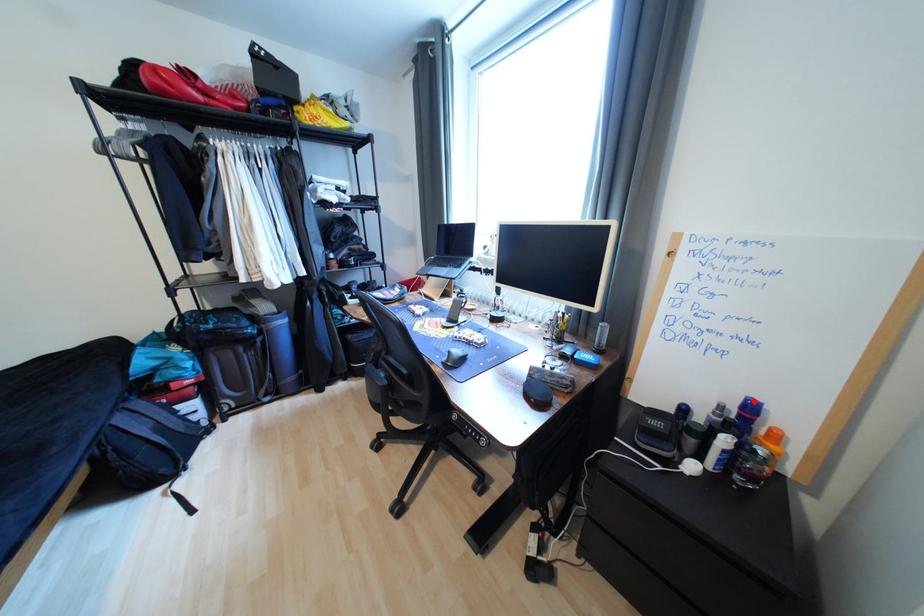
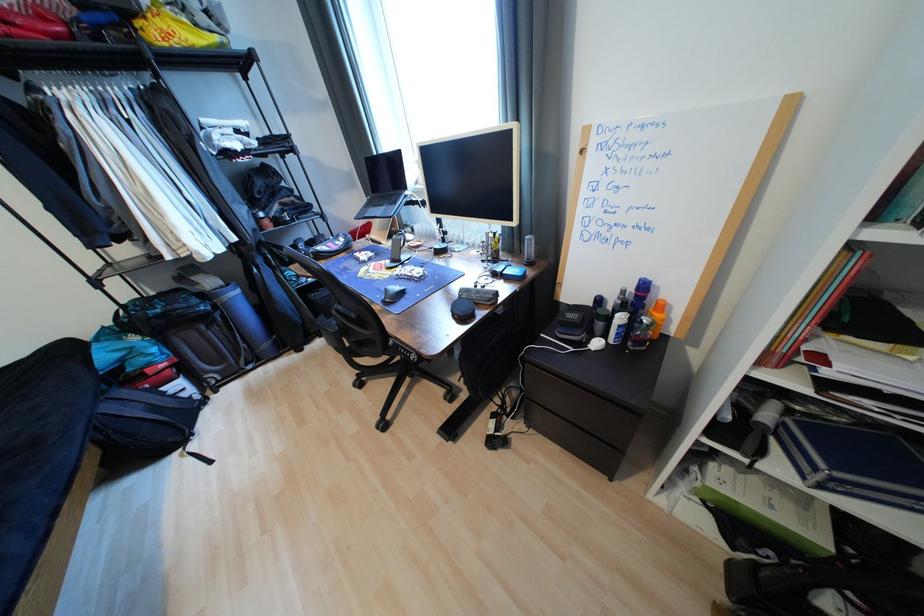
Locate, in the second image, the point that corresponds to the highlighted location in the first image.

(647, 282)